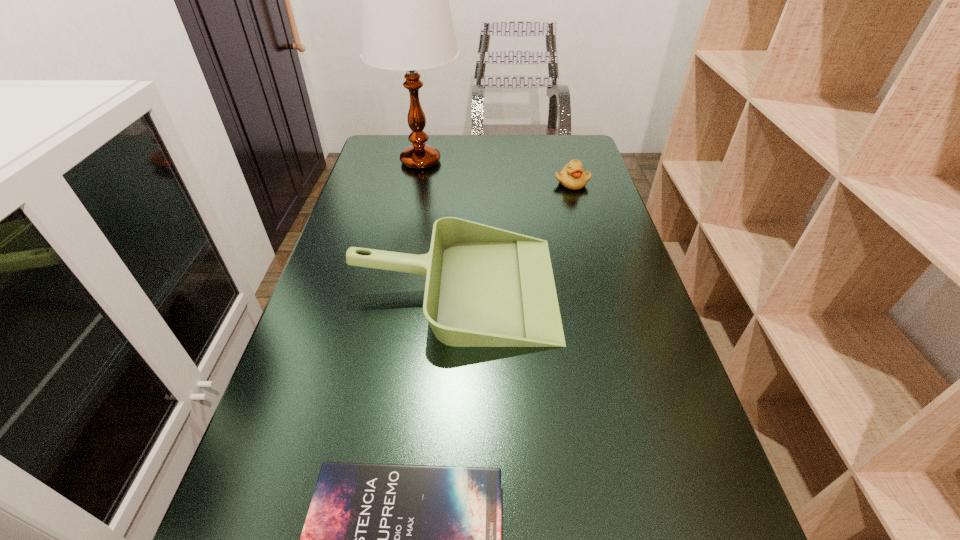
Where is `dustpan positioned at the left edge`? dustpan positioned at the left edge is located at coordinates (485, 287).

The image size is (960, 540). Identify the location of object that is at the right edge. (572, 176).

Locate an element on the screen. object located in the far left corner section of the desktop is located at coordinates (x=406, y=24).

This screenshot has height=540, width=960. In order to click on blank space at the far edge of the desktop in this screenshot , I will do `click(528, 144)`.

This screenshot has width=960, height=540. I want to click on free space at the left edge, so click(351, 330).

Identify the location of free space at the right edge of the desktop. Image resolution: width=960 pixels, height=540 pixels. (575, 279).

Identify the location of vacant space at the far left corner of the desktop. (400, 165).

The height and width of the screenshot is (540, 960). In order to click on free space at the far right corner of the desktop in this screenshot , I will do [545, 164].

Where is `vacant space that is in between the tallest object and the duckling`? The image size is (960, 540). vacant space that is in between the tallest object and the duckling is located at coordinates (496, 172).

This screenshot has width=960, height=540. Find the location of `object that stands as the closest to the table lamp`. object that stands as the closest to the table lamp is located at coordinates (485, 287).